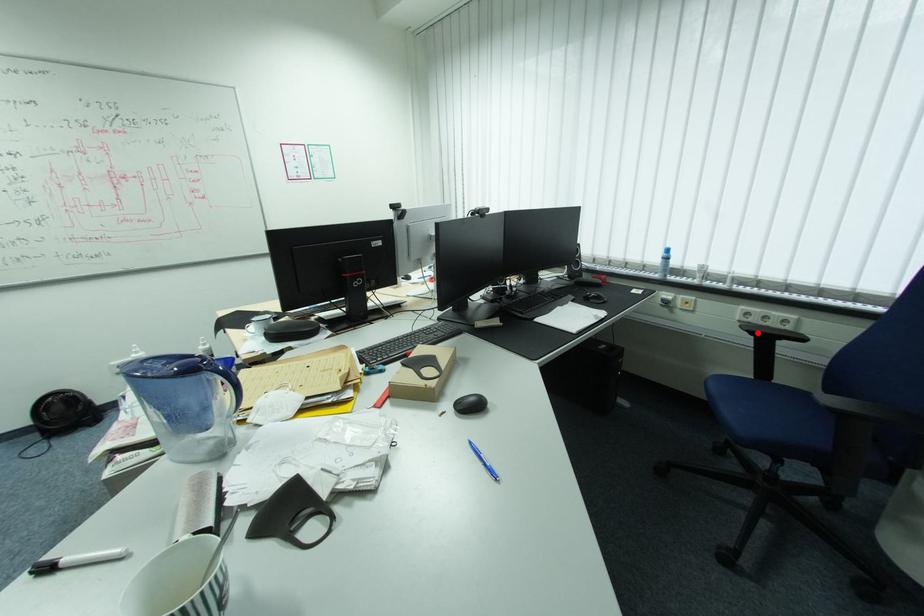
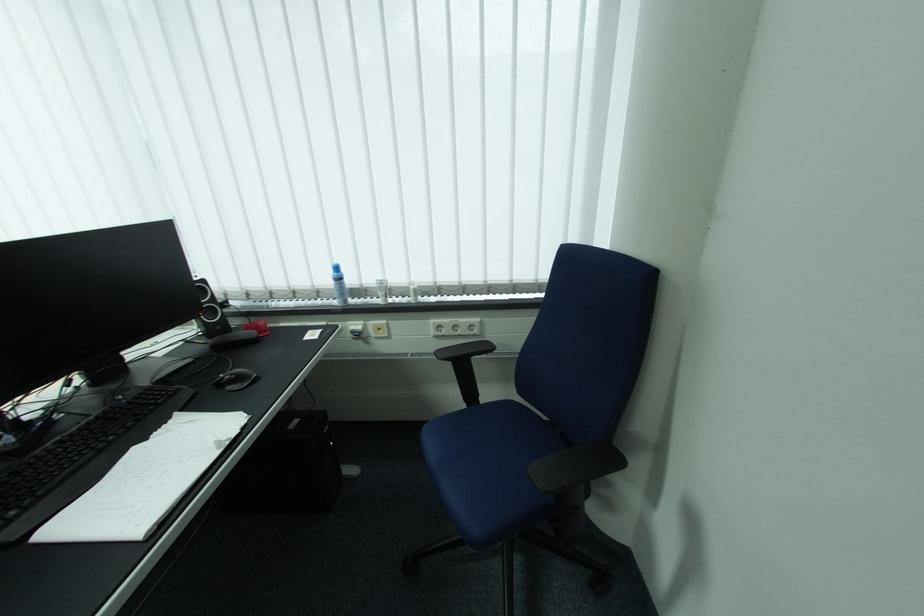
In the second image, find the point that corresponds to the highlighted location in the first image.

(455, 360)